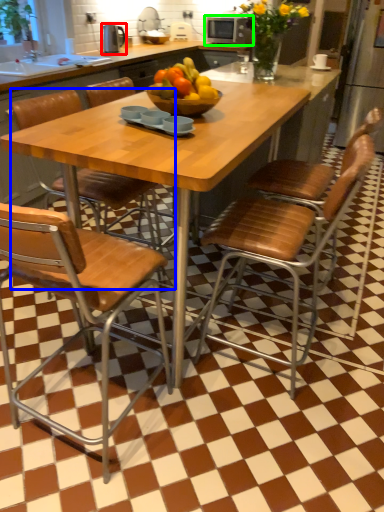
Question: Which object is the closest to the appliance (highlighted by a red box)? Choose among these: chair (highlighted by a blue box) or appliance (highlighted by a green box).

Choices:
 (A) chair
 (B) appliance

Answer: (B)